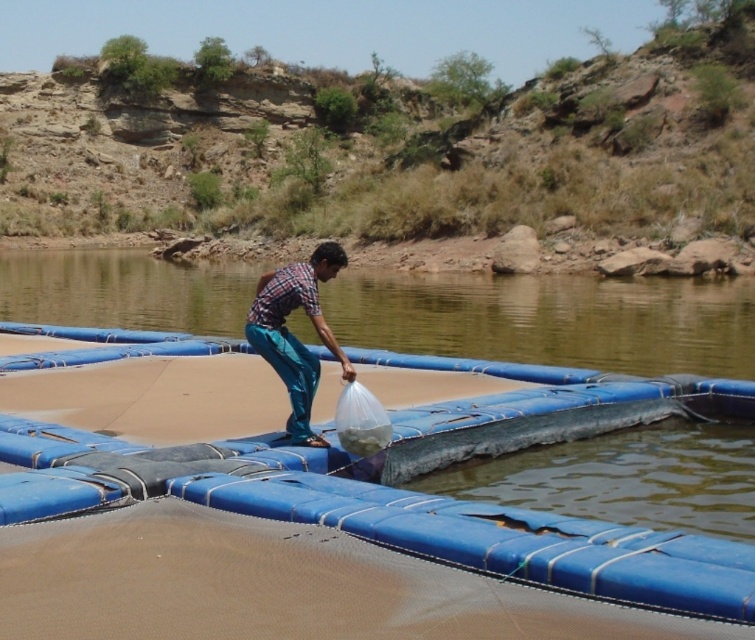
You are a safety inspector checking the water treatment facility. You notice the blue rubber raft at center and the plaid shirt at center. Which object is closer to you as you approach the floating structure?

The blue rubber raft at center is closer to you than the plaid shirt at center because it is further to the viewer.

You are a safety inspector checking the water treatment system. You notice the blue rubber raft at center and the plaid shirt at center. Which object is taller?

The blue rubber raft at center is taller than the plaid shirt at center.

You are a lifeguard standing at the edge of the water and see the point at coordinates (552, 320). What object is located at that point?

The point at coordinates (552, 320) corresponds to the blue rubber raft at center.